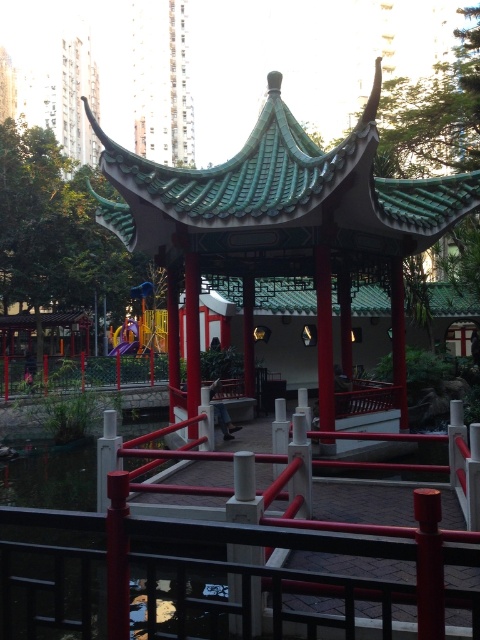
You are planning to place a large decorative statue in the park. The statue requires a space that is wider than the metallic red railing at center. Based on the scene, can the green glazed tile gazebo at center provide enough space for the statue?

The green glazed tile gazebo at center might be wider than the metallic red railing at center, so it could potentially provide sufficient space for the statue if the gazebo is indeed wider.

Looking at this image, you are standing at the entrance of the park and want to locate the green glazed tile gazebo at center. According to the map coordinates, where should you look to find it?

The green glazed tile gazebo at center is located at coordinates point (278, 224).